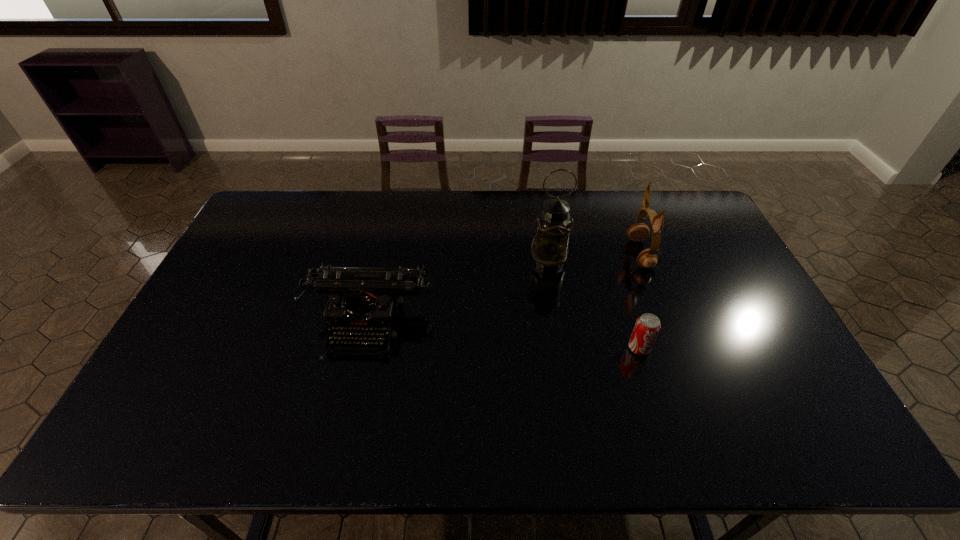
Identify which object is the third closest to the shortest object. Please provide its 2D coordinates. Your answer should be formatted as a tuple, i.e. [(x, y)], where the tuple contains the x and y coordinates of a point satisfying the conditions above.

[(365, 302)]

Find the location of a particular element. the closest object to the shortest object is located at coordinates (648, 258).

At what (x,y) coordinates should I click in order to perform the action: click on vacant position in the image that satisfies the following two spatial constraints: 1. on the front-facing side of the earphone; 2. on the logo side of the shortest object. Please return your answer as a coordinate pair (x, y). Looking at the image, I should click on (677, 348).

Find the location of `vacant region that satisfies the following two spatial constraints: 1. on the front-facing side of the earphone; 2. on the keyboard of the typewriter`. vacant region that satisfies the following two spatial constraints: 1. on the front-facing side of the earphone; 2. on the keyboard of the typewriter is located at coordinates (667, 322).

Identify the location of vacant region that satisfies the following two spatial constraints: 1. on the front-facing side of the third shortest object; 2. on the keyboard of the typewriter. (667, 322).